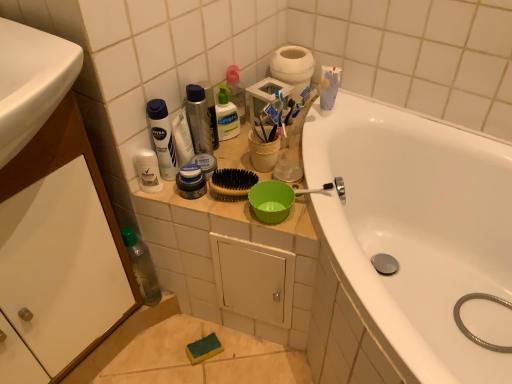
Question: Is clear plastic bottle at upper center, which is the 3th cleaning product from left to right, facing away from white cardboard toilet paper at upper center?

Choices:
 (A) no
 (B) yes

Answer: (A)

Question: From a real-world perspective, is clear plastic bottle at upper center, the 2th cleaning product in the right-to-left sequence, under white cardboard toilet paper at upper center?

Choices:
 (A) no
 (B) yes

Answer: (B)

Question: Does clear plastic bottle at upper center, the 2th cleaning product in the right-to-left sequence, have a larger size compared to white cardboard toilet paper at upper center?

Choices:
 (A) no
 (B) yes

Answer: (A)

Question: Does clear plastic bottle at upper center, the 2th cleaning product in the right-to-left sequence, come in front of white cardboard toilet paper at upper center?

Choices:
 (A) no
 (B) yes

Answer: (B)

Question: Is clear plastic bottle at upper center, the 2th cleaning product in the right-to-left sequence, surrounding white cardboard toilet paper at upper center?

Choices:
 (A) no
 (B) yes

Answer: (A)

Question: Can you confirm if clear plastic bottle at upper center, which is the 3th cleaning product from left to right, is taller than white cardboard toilet paper at upper center?

Choices:
 (A) yes
 (B) no

Answer: (B)

Question: Can you confirm if clear plastic bottle at upper center, which is the 3th cleaning product from left to right, is smaller than white matte deodorant at upper center, the 1th cleaning product in the left-to-right sequence?

Choices:
 (A) yes
 (B) no

Answer: (B)

Question: Would you say white matte deodorant at upper center, the 1th cleaning product in the left-to-right sequence, is part of clear plastic bottle at upper center, which is the 3th cleaning product from left to right,'s contents?

Choices:
 (A) no
 (B) yes

Answer: (A)

Question: Is clear plastic bottle at upper center, which is the 3th cleaning product from left to right, positioned behind white matte deodorant at upper center, the 1th cleaning product in the left-to-right sequence?

Choices:
 (A) no
 (B) yes

Answer: (B)

Question: Is clear plastic bottle at upper center, the 2th cleaning product in the right-to-left sequence, not near white matte deodorant at upper center, the 1th cleaning product in the left-to-right sequence?

Choices:
 (A) no
 (B) yes

Answer: (A)

Question: Considering the relative sizes of clear plastic bottle at upper center, which is the 3th cleaning product from left to right, and white matte deodorant at upper center, the 1th cleaning product in the left-to-right sequence, in the image provided, is clear plastic bottle at upper center, which is the 3th cleaning product from left to right, shorter than white matte deodorant at upper center, the 1th cleaning product in the left-to-right sequence,?

Choices:
 (A) no
 (B) yes

Answer: (B)

Question: Is clear plastic bottle at upper center, which is the 3th cleaning product from left to right, facing away from white matte deodorant at upper center, the 1th cleaning product in the left-to-right sequence?

Choices:
 (A) no
 (B) yes

Answer: (A)

Question: Considering the relative sizes of white glossy bathtub at upper right and clear plastic bottle at upper center, the 2th cleaning product in the right-to-left sequence, in the image provided, is white glossy bathtub at upper right bigger than clear plastic bottle at upper center, the 2th cleaning product in the right-to-left sequence,?

Choices:
 (A) no
 (B) yes

Answer: (B)